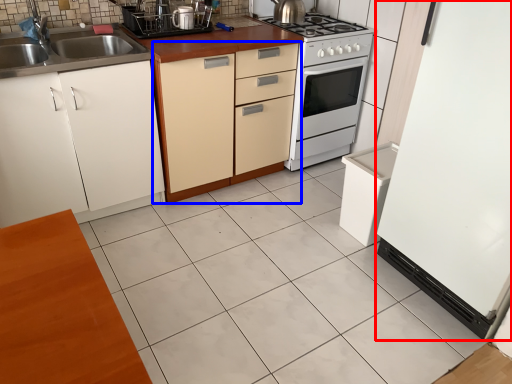
Question: Which object is closer to the camera taking this photo, appliance (highlighted by a red box) or cabinetry (highlighted by a blue box)?

Choices:
 (A) appliance
 (B) cabinetry

Answer: (A)